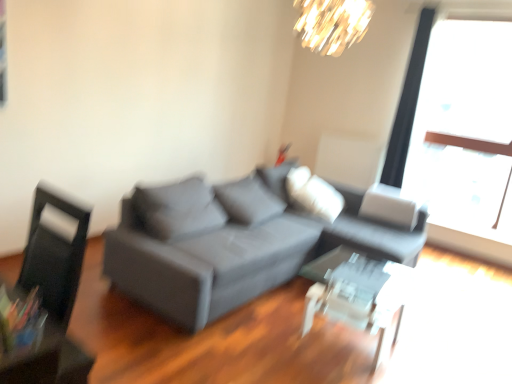
Describe the element at coordinates (55, 255) in the screenshot. I see `black leather swivel chair at left` at that location.

The image size is (512, 384). In order to click on shiny gold chandelier at upper center in this screenshot , I will do `click(332, 24)`.

What do you see at coordinates (232, 247) in the screenshot? Image resolution: width=512 pixels, height=384 pixels. I see `matte gray couch at center` at bounding box center [232, 247].

At what (x,y) coordinates should I click in order to perform the action: click on transparent glass table at center. Please return your answer as a coordinate pair (x, y). The image size is (512, 384). Looking at the image, I should click on (357, 292).

Are black leather swivel chair at left and transparent glass table at center beside each other?

black leather swivel chair at left is not next to transparent glass table at center, and they're not touching.

In the scene shown: Which is more to the right, black leather swivel chair at left or transparent glass table at center?

Positioned to the right is transparent glass table at center.

Is black leather swivel chair at left oriented away from transparent glass table at center?

Absolutely, black leather swivel chair at left is directed away from transparent glass table at center.

Which of these two, black leather swivel chair at left or transparent glass table at center, is wider?

transparent glass table at center is wider.

How different are the orientations of transparent glass table at center and black leather swivel chair at left in degrees?

transparent glass table at center and black leather swivel chair at left are facing 90 degrees away from each other.

Consider the image. From a real-world perspective, which object stands above the other?

black leather swivel chair at left.

Is transparent glass table at center smaller than black leather swivel chair at left?

No.

Is transparent glass table at center further to the viewer compared to black leather swivel chair at left?

Yes, transparent glass table at center is behind black leather swivel chair at left.

Could you tell me if transparent glass table at center is turned towards shiny gold chandelier at upper center?

No, transparent glass table at center is not aimed at shiny gold chandelier at upper center.

Which of these two, transparent glass table at center or shiny gold chandelier at upper center, is bigger?

transparent glass table at center.

From the picture: Would you say shiny gold chandelier at upper center is part of transparent glass table at center's contents?

No, transparent glass table at center does not contain shiny gold chandelier at upper center.

The height and width of the screenshot is (384, 512). What are the coordinates of `table below the shiny gold chandelier at upper center (from the image's perspective)` in the screenshot? It's located at click(357, 292).

From the image's perspective, which one is positioned lower, matte gray couch at center or shiny gold chandelier at upper center?

matte gray couch at center is shown below in the image.

Is matte gray couch at center at the left side of shiny gold chandelier at upper center?

Yes.

How many degrees apart are the facing directions of matte gray couch at center and shiny gold chandelier at upper center?

The angle between the facing direction of matte gray couch at center and the facing direction of shiny gold chandelier at upper center is 84.7 degrees.

Is matte gray couch at center closer to camera compared to shiny gold chandelier at upper center?

Yes, matte gray couch at center is closer to the camera.

Is transparent glass window at upper right with transparent glass table at center?

transparent glass window at upper right is not next to transparent glass table at center, and they're not touching.

Based on their positions, is transparent glass window at upper right located to the left or right of transparent glass table at center?

In the image, transparent glass window at upper right appears on the right side of transparent glass table at center.

Which is nearer, (490, 82) or (389, 270)?

Positioned in front is point (389, 270).

Considering the relative positions of transparent glass window at upper right and transparent glass table at center in the image provided, is transparent glass window at upper right in front of transparent glass table at center?

No, transparent glass window at upper right is further to the viewer.

Between transparent glass table at center and transparent glass window at upper right, which one appears on the right side from the viewer's perspective?

transparent glass window at upper right is more to the right.

Is point (312, 267) closer or farther from the camera than point (437, 72)?

Point (312, 267).

Can you confirm if transparent glass table at center is wider than transparent glass window at upper right?

Yes, transparent glass table at center is wider than transparent glass window at upper right.

From the image's perspective, which is above, transparent glass table at center or transparent glass window at upper right?

transparent glass window at upper right, from the image's perspective.

From the image's perspective, does black leather swivel chair at left appear lower than transparent glass window at upper right?

Yes, from the image's perspective, black leather swivel chair at left is below transparent glass window at upper right.

From a real-world perspective, which object stands above the other?

transparent glass window at upper right, from a real-world perspective.

Who is more distant, black leather swivel chair at left or transparent glass window at upper right?

transparent glass window at upper right is further from the camera.

Which object is positioned more to the right, black leather swivel chair at left or transparent glass window at upper right?

From the viewer's perspective, transparent glass window at upper right appears more on the right side.

Image resolution: width=512 pixels, height=384 pixels. What are the coordinates of `swivel chair above the transparent glass table at center (from a real-world perspective)` in the screenshot? It's located at (55, 255).

The width and height of the screenshot is (512, 384). In order to click on table that appears on the right of black leather swivel chair at left in this screenshot , I will do `click(357, 292)`.

Estimate the real-world distances between objects in this image. Which object is further from matte gray couch at center, black leather swivel chair at left or transparent glass table at center?

black leather swivel chair at left.

Considering their positions, is matte gray couch at center positioned closer to transparent glass table at center than shiny gold chandelier at upper center?

matte gray couch at center is positioned closer to the anchor transparent glass table at center.

Looking at this image, from the image, which object appears to be farther from matte gray couch at center, shiny gold chandelier at upper center or black leather swivel chair at left?

Among the two, shiny gold chandelier at upper center is located further to matte gray couch at center.

Looking at the image, which one is located further to shiny gold chandelier at upper center, transparent glass table at center or matte gray couch at center?

transparent glass table at center lies further to shiny gold chandelier at upper center than the other object.

Estimate the real-world distances between objects in this image. Which object is further from shiny gold chandelier at upper center, black leather swivel chair at left or transparent glass table at center?

Based on the image, black leather swivel chair at left appears to be further to shiny gold chandelier at upper center.

Looking at the image, which one is located closer to shiny gold chandelier at upper center, transparent glass window at upper right or transparent glass table at center?

Based on the image, transparent glass window at upper right appears to be nearer to shiny gold chandelier at upper center.

Estimate the real-world distances between objects in this image. Which object is closer to transparent glass window at upper right, matte gray couch at center or shiny gold chandelier at upper center?

shiny gold chandelier at upper center.

Which object lies nearer to the anchor point black leather swivel chair at left, transparent glass table at center or matte gray couch at center?

matte gray couch at center is closer to black leather swivel chair at left.

At what (x,y) coordinates should I click in order to perform the action: click on table between black leather swivel chair at left and transparent glass window at upper right from left to right. Please return your answer as a coordinate pair (x, y). This screenshot has width=512, height=384. Looking at the image, I should click on (357, 292).

Locate an element on the screen. This screenshot has height=384, width=512. studio couch located between black leather swivel chair at left and transparent glass window at upper right in the left-right direction is located at coordinates (232, 247).

At what (x,y) coordinates should I click in order to perform the action: click on lamp between black leather swivel chair at left and transparent glass window at upper right from left to right. Please return your answer as a coordinate pair (x, y). The width and height of the screenshot is (512, 384). Looking at the image, I should click on (x=332, y=24).

Where is `studio couch that lies between shiny gold chandelier at upper center and black leather swivel chair at left from top to bottom`? studio couch that lies between shiny gold chandelier at upper center and black leather swivel chair at left from top to bottom is located at coordinates (232, 247).